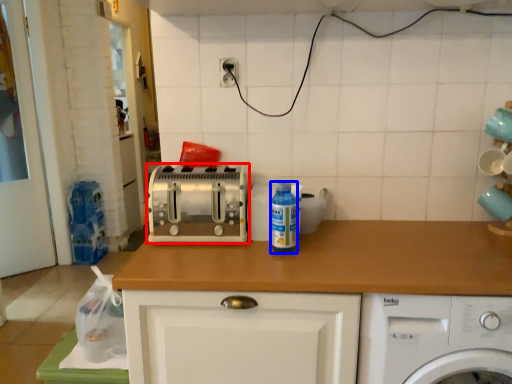
Question: Among these objects, which one is farthest to the camera, toaster (highlighted by a red box) or bottle (highlighted by a blue box)?

Choices:
 (A) toaster
 (B) bottle

Answer: (B)